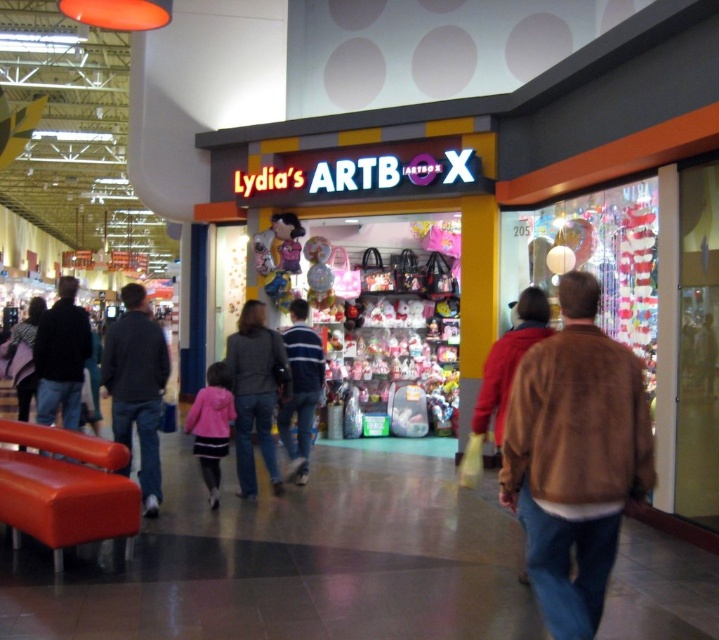
Question: Estimate the real-world distances between objects in this image. Which object is closer to the striped sweater at center?

Choices:
 (A) dark gray sweater at center
 (B) brown suede jacket at lower right
 (C) dark brown leather jacket at left

Answer: (A)

Question: Which object is closer to the camera taking this photo?

Choices:
 (A) striped sweater at center
 (B) dark brown leather jacket at left

Answer: (B)

Question: Is dark gray sweater at center positioned behind dark brown leather jacket at left?

Choices:
 (A) no
 (B) yes

Answer: (A)

Question: Is brown suede jacket at lower right above dark brown leather jacket at left?

Choices:
 (A) no
 (B) yes

Answer: (B)

Question: Among these points, which one is nearest to the camera?

Choices:
 (A) (35, 340)
 (B) (599, 403)

Answer: (B)

Question: From the image, what is the correct spatial relationship of brown suede jacket at lower right in relation to dark gray sweater at center?

Choices:
 (A) right
 (B) left

Answer: (A)